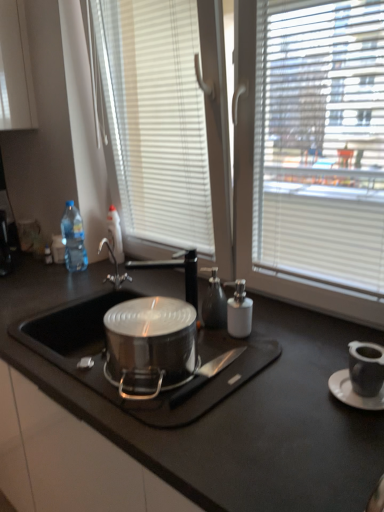
The image size is (384, 512). Identify the location of free point above black matte countertop at center (from a real-world perspective). (195, 346).